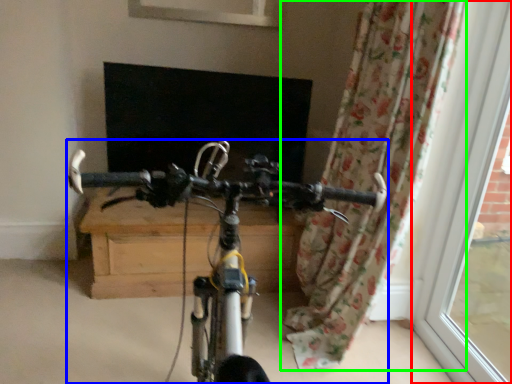
Question: Which is farther away from window frame (highlighted by a red box)? bicycle (highlighted by a blue box) or curtain (highlighted by a green box)?

Choices:
 (A) bicycle
 (B) curtain

Answer: (A)